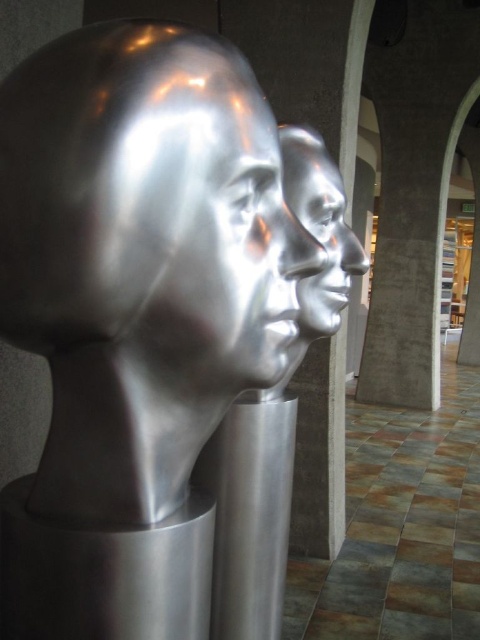
You are an art curator planning to install a new sculpture that is 1.5 meters tall. You observe the shiny metallic head at center and the polished silver face at center in the current installation. Which existing sculpture can the new sculpture fit between in terms of size?

The new sculpture that is 1.5 meters tall can fit between the shiny metallic head at center and the polished silver face at center because the shiny metallic head at center is smaller than the polished silver face at center.

You are an art critic standing in front of the modern art installation. You notice two sculptures labeled as the shiny metallic head at center and the polished silver face at center. Which sculpture is positioned closer to you?

The shiny metallic head at center is closer to the viewer than the polished silver face at center.